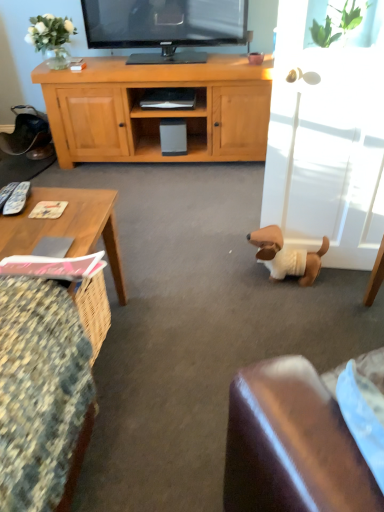
At what (x,y) coordinates should I click in order to perform the action: click on vacant region in front of white glossy glass door at right. Please return your answer as a coordinate pair (x, y). Looking at the image, I should click on (327, 308).